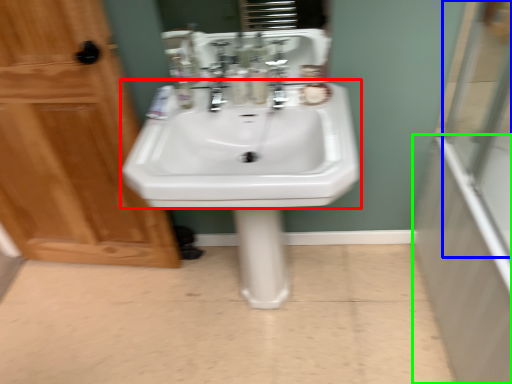
Question: Estimate the real-world distances between objects in this image. Which object is farther from sink (highlighted by a red box), glass door (highlighted by a blue box) or bath (highlighted by a green box)?

Choices:
 (A) glass door
 (B) bath

Answer: (A)